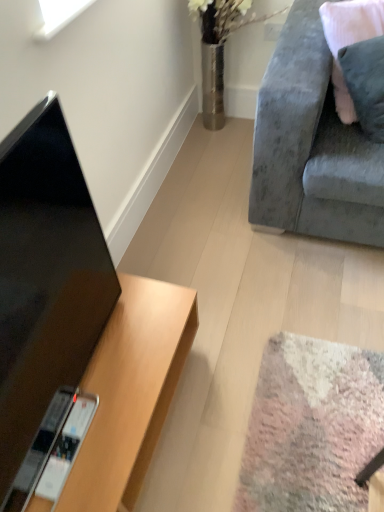
I want to click on free space between velvet grey couch at upper right and wooden desk at lower left, so click(x=244, y=304).